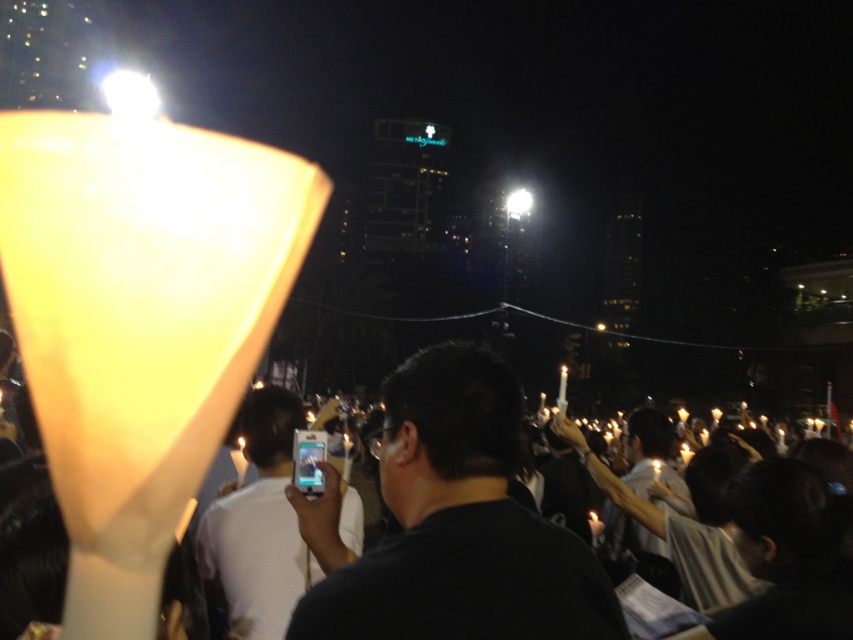
Question: Is matte white candle at center to the right of black matte phone at center from the viewer's perspective?

Choices:
 (A) yes
 (B) no

Answer: (A)

Question: Considering the relative positions of matte white candle at center and white glossy phone at center in the image provided, where is matte white candle at center located with respect to white glossy phone at center?

Choices:
 (A) left
 (B) right

Answer: (B)

Question: Which of the following is the farthest from the observer?

Choices:
 (A) (489, 563)
 (B) (247, 554)
 (C) (467, 616)

Answer: (B)

Question: Is matte white candle at center positioned before black matte phone at center?

Choices:
 (A) yes
 (B) no

Answer: (A)

Question: Which object is closer to the camera taking this photo?

Choices:
 (A) matte white candle at center
 (B) white glossy phone at center

Answer: (A)

Question: Estimate the real-world distances between objects in this image. Which object is farther from the black matte phone at center?

Choices:
 (A) white glossy phone at center
 (B) matte white candle at center

Answer: (A)